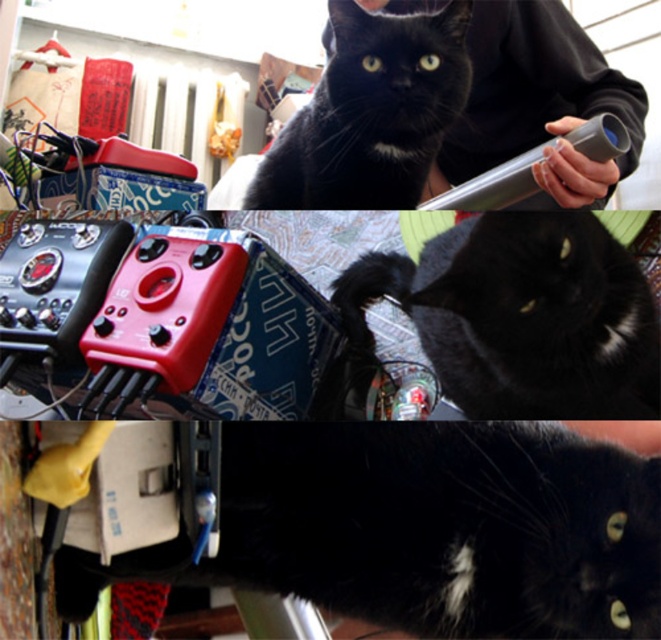
Question: Where is black glossy cat at center located in relation to black fur cat at upper center in the image?

Choices:
 (A) above
 (B) below

Answer: (B)

Question: Is black fur cat at center bigger than black fur cat at upper center?

Choices:
 (A) no
 (B) yes

Answer: (A)

Question: Which object is the closest to the black fur cat at center?

Choices:
 (A) black glossy cat at center
 (B) black fur cat at upper center

Answer: (A)

Question: Which point appears closest to the camera in this image?

Choices:
 (A) (385, 584)
 (B) (605, 328)
 (C) (330, 52)

Answer: (A)

Question: Which of the following is the farthest from the observer?

Choices:
 (A) (502, 285)
 (B) (379, 563)

Answer: (A)

Question: From the image, what is the correct spatial relationship of black glossy cat at center in relation to black fur cat at upper center?

Choices:
 (A) below
 (B) above

Answer: (A)